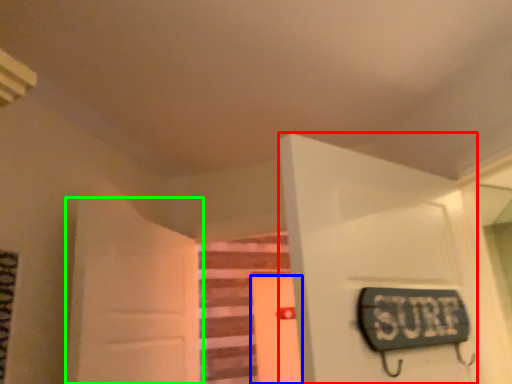
Question: Based on their relative distances, which object is nearer to door (highlighted by a red box)? Choose from door (highlighted by a blue box) and door (highlighted by a green box).

Choices:
 (A) door
 (B) door

Answer: (B)